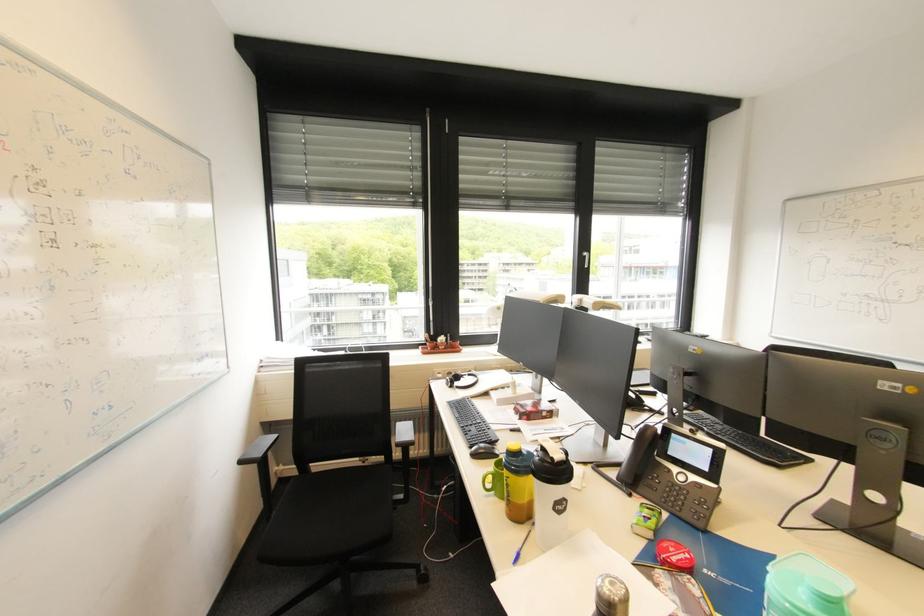
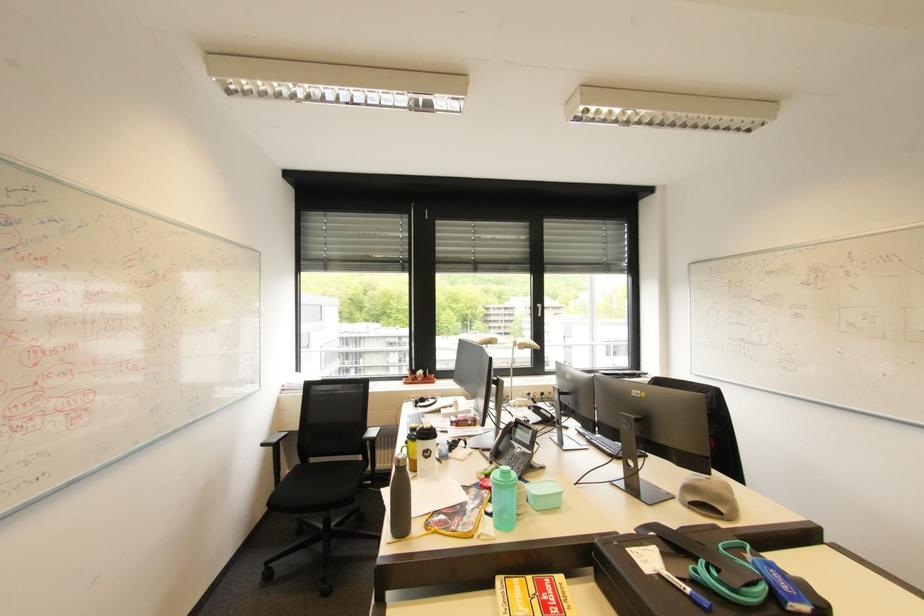
Question: Based on the continuous images, in which direction is the camera rotating? Reply with the corresponding letter.

Choices:
 (A) Left
 (B) Right
 (C) Up
 (D) Down

Answer: (C)